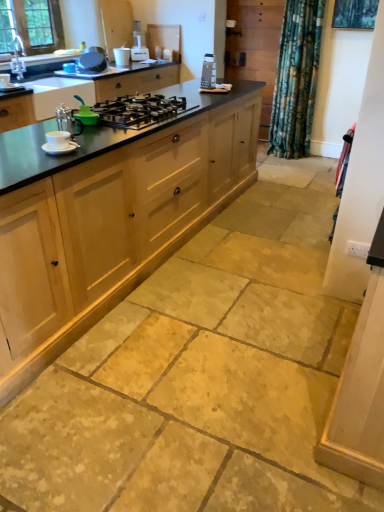
The width and height of the screenshot is (384, 512). What do you see at coordinates (139, 47) in the screenshot?
I see `white plastic toaster at upper center` at bounding box center [139, 47].

The image size is (384, 512). Describe the element at coordinates (208, 72) in the screenshot. I see `metallic silver grater at center, the 2th appliance in the bottom-to-top sequence` at that location.

You are a GUI agent. You are given a task and a screenshot of the screen. Output one action in this format:
    pyautogui.click(x=<x>, y=<y>)
    Task: Click on the black polished countertop at left
    
    Given the screenshot: What is the action you would take?
    pyautogui.click(x=95, y=137)

This screenshot has width=384, height=512. What do you see at coordinates (85, 114) in the screenshot?
I see `green matte teapot at center-left, which is counted as the 1th appliance, starting from the bottom` at bounding box center [85, 114].

This screenshot has width=384, height=512. What do you see at coordinates (361, 185) in the screenshot?
I see `white glossy screen door at right` at bounding box center [361, 185].

In order to click on white plastic toaster at upper center in this screenshot , I will do `click(139, 47)`.

From a real-world perspective, relative to green matte teapot at center-left, which is the second appliance in left-to-right order, is natural wood cabinetry at center vertically above or below?

natural wood cabinetry at center is situated lower than green matte teapot at center-left, which is the second appliance in left-to-right order, in the real world.

Image resolution: width=384 pixels, height=512 pixels. I want to click on appliance that is the 1st one when counting backward from the natural wood cabinetry at center, so coord(85,114).

Does point (147, 273) come closer to viewer compared to point (96, 117)?

No, (147, 273) is further to viewer.

Based on their sizes in the image, would you say natural wood cabinetry at center is bigger or smaller than green matte teapot at center-left, which is the second appliance in left-to-right order?

Clearly, natural wood cabinetry at center is larger in size than green matte teapot at center-left, which is the second appliance in left-to-right order.

Who is more distant, white glossy screen door at right or white plastic toaster at upper center?

white plastic toaster at upper center is further away from the camera.

From a real-world perspective, is white glossy screen door at right below white plastic toaster at upper center?

Yes, from a real-world perspective, white glossy screen door at right is under white plastic toaster at upper center.

Does point (335, 288) come behind point (141, 49)?

That is False.

Is white plastic toaster at upper center surrounded by white glossy screen door at right?

No, white plastic toaster at upper center is not inside white glossy screen door at right.

In terms of height, does black matte gas stove at center look taller or shorter compared to white glossy screen door at right?

Considering their sizes, black matte gas stove at center has less height than white glossy screen door at right.

Where is `screen door in front of the black matte gas stove at center`? screen door in front of the black matte gas stove at center is located at coordinates pyautogui.click(x=361, y=185).

From a real-world perspective, which is physically below, black matte gas stove at center or white glossy screen door at right?

From a 3D spatial view, white glossy screen door at right is below.

Is green matte teapot at center-left, placed as the 2th appliance when sorted from right to left, at the left side of white plastic toaster at upper center?

Incorrect, green matte teapot at center-left, placed as the 2th appliance when sorted from right to left, is not on the left side of white plastic toaster at upper center.

Considering the relative sizes of green matte teapot at center-left, which is the second appliance in left-to-right order, and white plastic toaster at upper center in the image provided, is green matte teapot at center-left, which is the second appliance in left-to-right order, shorter than white plastic toaster at upper center?

Yes.

Is green matte teapot at center-left, which is the third appliance from back to front, far from white plastic toaster at upper center?

Absolutely, green matte teapot at center-left, which is the third appliance from back to front, is distant from white plastic toaster at upper center.

Do you think green matte teapot at center-left, which is the third appliance in top-to-bottom order, is within white plastic toaster at upper center, or outside of it?

green matte teapot at center-left, which is the third appliance in top-to-bottom order, is not enclosed by white plastic toaster at upper center.

Is black polished countertop at left thinner than metallic silver grater at center, which is counted as the third appliance, starting from the left?

Incorrect, the width of black polished countertop at left is not less than that of metallic silver grater at center, which is counted as the third appliance, starting from the left.

Are black polished countertop at left and metallic silver grater at center, which is the first appliance from right to left, far apart?

Yes.

Which object is positioned more to the left, black polished countertop at left or metallic silver grater at center, arranged as the 2th appliance when viewed from the top?

From the viewer's perspective, black polished countertop at left appears more on the left side.

From a real-world perspective, is black polished countertop at left on metallic silver grater at center, the 2th appliance positioned from the front?

Incorrect, from a real-world perspective, black polished countertop at left is lower than metallic silver grater at center, the 2th appliance positioned from the front.

Is metallic silver grater at center, which is counted as the third appliance, starting from the left, bigger or smaller than matte silver sink at upper left?

In the image, metallic silver grater at center, which is counted as the third appliance, starting from the left, appears to be smaller than matte silver sink at upper left.

From the image's perspective, is metallic silver grater at center, which is counted as the third appliance, starting from the left, above or below matte silver sink at upper left?

metallic silver grater at center, which is counted as the third appliance, starting from the left, is situated lower than matte silver sink at upper left in the image.

Could you tell me if metallic silver grater at center, the 2th appliance positioned from the front, is turned towards matte silver sink at upper left?

No, metallic silver grater at center, the 2th appliance positioned from the front, is not oriented towards matte silver sink at upper left.

Which of these two, matte silver sink at upper left or white plastic toaster at upper center, is bigger?

white plastic toaster at upper center.

Is matte silver sink at upper left taller than white plastic toaster at upper center?

No, matte silver sink at upper left is not taller than white plastic toaster at upper center.

Looking at this image, relative to white plastic toaster at upper center, is matte silver sink at upper left in front or behind?

matte silver sink at upper left is in front of white plastic toaster at upper center.

From a real-world perspective, which object rests below the other?

In real-world perspective, matte silver sink at upper left is lower.

You are a GUI agent. You are given a task and a screenshot of the screen. Output one action in this format:
    pyautogui.click(x=<x>, y=<y>)
    Task: Click on the cabinetry lying on the right of green matte teapot at center-left, which is the third appliance from back to front
    The image size is (384, 512).
    Given the screenshot: What is the action you would take?
    pyautogui.click(x=114, y=224)

Locate an element on the screen. The height and width of the screenshot is (512, 384). kitchen appliance above the white glossy screen door at right (from a real-world perspective) is located at coordinates tap(139, 47).

Estimate the real-world distances between objects in this image. Which object is closer to metallic silver grater at center, the 2th appliance in the bottom-to-top sequence, green matte teapot at center-left, which is the third appliance in top-to-bottom order, or natural wood cabinetry at center?

natural wood cabinetry at center.

Considering their positions, is metallic silver grater at center, which is counted as the third appliance, starting from the left, positioned closer to green matte teapot at center-left, placed as the 2th appliance when sorted from right to left, than black polished countertop at left?

black polished countertop at left lies closer to green matte teapot at center-left, placed as the 2th appliance when sorted from right to left, than the other object.

Estimate the real-world distances between objects in this image. Which object is further from white glossy screen door at right, black polished countertop at left or green matte teapot at center-left, which is the second appliance in left-to-right order?

green matte teapot at center-left, which is the second appliance in left-to-right order, is positioned further to the anchor white glossy screen door at right.

Considering their positions, is green matte teapot at center-left, placed as the 2th appliance when sorted from right to left, positioned closer to natural wood cabinetry at center than metallic silver pot at upper center, marked as the 1th appliance in a left-to-right arrangement?

Based on the image, green matte teapot at center-left, placed as the 2th appliance when sorted from right to left, appears to be nearer to natural wood cabinetry at center.

Estimate the real-world distances between objects in this image. Which object is closer to metallic silver grater at center, which ranks as the second appliance in back-to-front order, green matte teapot at center-left, placed as the 2th appliance when sorted from right to left, or metallic silver pot at upper center, which is counted as the 3th appliance, starting from the right?

Among the two, metallic silver pot at upper center, which is counted as the 3th appliance, starting from the right, is located nearer to metallic silver grater at center, which ranks as the second appliance in back-to-front order.

Based on their spatial positions, is natural wood cabinetry at center or white plastic toaster at upper center closer to black polished countertop at left?

Among the two, natural wood cabinetry at center is located nearer to black polished countertop at left.

Estimate the real-world distances between objects in this image. Which object is closer to black matte gas stove at center, green matte teapot at center-left, which is the third appliance in top-to-bottom order, or metallic silver pot at upper center, which is the first appliance from back to front?

Based on the image, green matte teapot at center-left, which is the third appliance in top-to-bottom order, appears to be nearer to black matte gas stove at center.

Which object lies nearer to the anchor point black matte gas stove at center, black polished countertop at left or natural wood cabinetry at center?

Based on the image, black polished countertop at left appears to be nearer to black matte gas stove at center.

Find the location of a particular element. This screenshot has width=384, height=512. gas stove between natural wood cabinetry at center and metallic silver grater at center, which is counted as the third appliance, starting from the left, from front to back is located at coordinates (139, 110).

The image size is (384, 512). I want to click on cabinetry between matte silver sink at upper left and white glossy screen door at right, so click(x=114, y=224).

Locate an element on the screen. This screenshot has width=384, height=512. countertop between matte silver sink at upper left and metallic silver grater at center, which is the first appliance from right to left is located at coordinates (95, 137).

Image resolution: width=384 pixels, height=512 pixels. I want to click on gas stove between natural wood cabinetry at center and white plastic toaster at upper center in the front-back direction, so click(x=139, y=110).